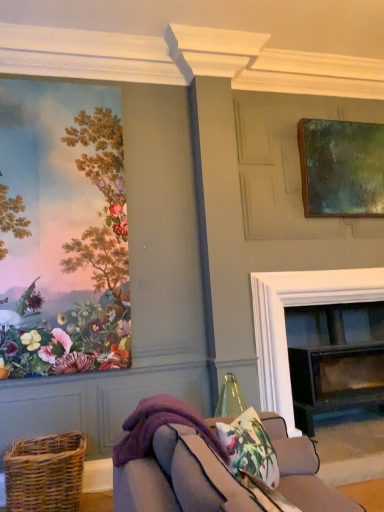
Question: From a real-world perspective, is floral fabric cushion at lower center located beneath purple fleece blanket at lower center?

Choices:
 (A) yes
 (B) no

Answer: (A)

Question: Is floral fabric cushion at lower center next to purple fleece blanket at lower center?

Choices:
 (A) no
 (B) yes

Answer: (A)

Question: Is floral fabric cushion at lower center bigger than purple fleece blanket at lower center?

Choices:
 (A) no
 (B) yes

Answer: (A)

Question: Is floral fabric cushion at lower center facing towards purple fleece blanket at lower center?

Choices:
 (A) no
 (B) yes

Answer: (A)

Question: Considering the relative sizes of floral fabric cushion at lower center and purple fleece blanket at lower center in the image provided, is floral fabric cushion at lower center smaller than purple fleece blanket at lower center?

Choices:
 (A) yes
 (B) no

Answer: (A)

Question: Is floral fabric cushion at lower center far away from purple fleece blanket at lower center?

Choices:
 (A) yes
 (B) no

Answer: (B)

Question: Does black glass fireplace at center have a greater height compared to floral fabric cushion at lower center?

Choices:
 (A) no
 (B) yes

Answer: (B)

Question: Does black glass fireplace at center have a smaller size compared to floral fabric cushion at lower center?

Choices:
 (A) yes
 (B) no

Answer: (B)

Question: Is floral fabric cushion at lower center at the back of black glass fireplace at center?

Choices:
 (A) yes
 (B) no

Answer: (B)

Question: Is black glass fireplace at center to the left of floral fabric cushion at lower center from the viewer's perspective?

Choices:
 (A) no
 (B) yes

Answer: (A)

Question: Is black glass fireplace at center to the right of floral fabric cushion at lower center from the viewer's perspective?

Choices:
 (A) no
 (B) yes

Answer: (B)

Question: Considering the relative sizes of black glass fireplace at center and floral fabric cushion at lower center in the image provided, is black glass fireplace at center wider than floral fabric cushion at lower center?

Choices:
 (A) no
 (B) yes

Answer: (B)

Question: Can you confirm if black glass fireplace at center is shorter than matte floral wallpaper at left, positioned as the 2th picture frame in back-to-front order?

Choices:
 (A) no
 (B) yes

Answer: (B)